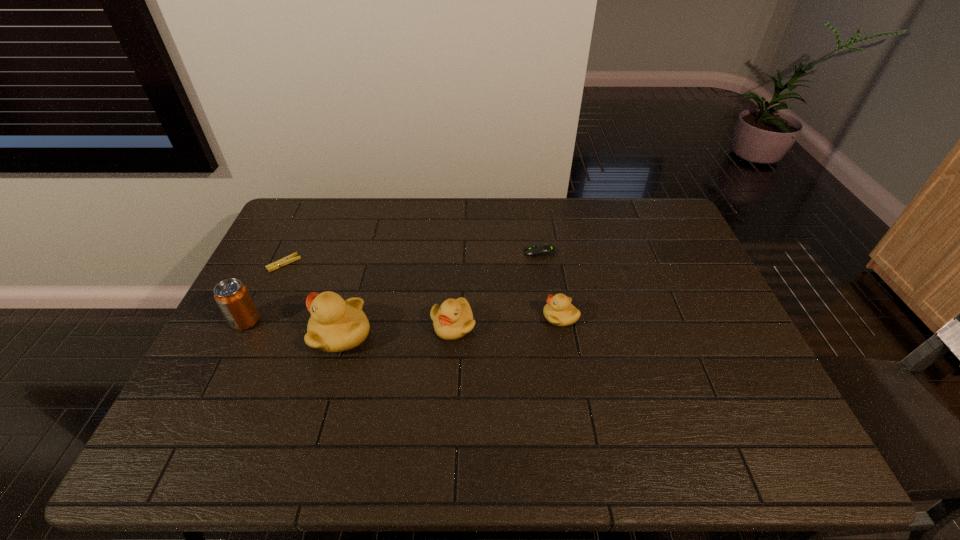
The width and height of the screenshot is (960, 540). I want to click on duckling that is the third closest to the soda can, so tap(559, 311).

Locate an element on the screen. free space that satisfies the following two spatial constraints: 1. on the beak of the second tallest duckling; 2. on the beak of the fourth object from right to left is located at coordinates point(453,334).

You are a GUI agent. You are given a task and a screenshot of the screen. Output one action in this format:
    pyautogui.click(x=<x>, y=<y>)
    Task: Click on the free space in the image that satisfies the following two spatial constraints: 1. on the wheel side of the computer mouse; 2. on the front side of the shortest object
    This screenshot has width=960, height=540.
    Given the screenshot: What is the action you would take?
    pyautogui.click(x=541, y=264)